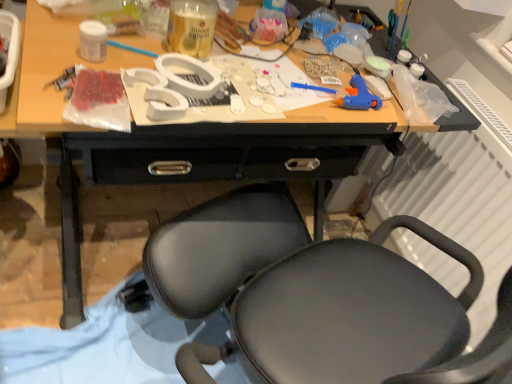
Question: Is white matte jar at upper left, acting as the third bottle starting from the right, at the right side of white plastic radiator at right?

Choices:
 (A) yes
 (B) no

Answer: (B)

Question: Does white matte jar at upper left, the 1th bottle viewed from the left, have a smaller size compared to white plastic radiator at right?

Choices:
 (A) yes
 (B) no

Answer: (A)

Question: Is the surface of white matte jar at upper left, arranged as the 3th bottle when viewed from the back, in direct contact with white plastic radiator at right?

Choices:
 (A) no
 (B) yes

Answer: (A)

Question: Can you confirm if white matte jar at upper left, acting as the third bottle starting from the right, is shorter than white plastic radiator at right?

Choices:
 (A) yes
 (B) no

Answer: (A)

Question: Is white matte jar at upper left, placed as the first bottle when sorted from front to back, to the left of white plastic radiator at right from the viewer's perspective?

Choices:
 (A) yes
 (B) no

Answer: (A)

Question: Relative to white plastic radiator at right, is translucent glass bottle at center, the second bottle from the back, in front or behind?

Choices:
 (A) behind
 (B) front

Answer: (A)

Question: Considering the positions of translucent glass bottle at center, the second bottle viewed from the right, and white plastic radiator at right in the image, is translucent glass bottle at center, the second bottle viewed from the right, wider or thinner than white plastic radiator at right?

Choices:
 (A) wide
 (B) thin

Answer: (A)

Question: Considering the positions of translucent glass bottle at center, which appears as the 2th bottle when viewed from the front, and white plastic radiator at right in the image, is translucent glass bottle at center, which appears as the 2th bottle when viewed from the front, taller or shorter than white plastic radiator at right?

Choices:
 (A) tall
 (B) short

Answer: (B)

Question: From a real-world perspective, is translucent glass bottle at center, placed as the second bottle when sorted from left to right, positioned above or below white plastic radiator at right?

Choices:
 (A) below
 (B) above

Answer: (B)

Question: Considering their positions, is white plastic radiator at right located in front of or behind white matte jar at upper left, the 1th bottle viewed from the left?

Choices:
 (A) front
 (B) behind

Answer: (A)

Question: Is white plastic radiator at right taller or shorter than white matte jar at upper left, placed as the first bottle when sorted from front to back?

Choices:
 (A) short
 (B) tall

Answer: (B)

Question: Considering the relative positions of white plastic radiator at right and white matte jar at upper left, the 1th bottle viewed from the left, in the image provided, is white plastic radiator at right to the left or to the right of white matte jar at upper left, the 1th bottle viewed from the left,?

Choices:
 (A) left
 (B) right

Answer: (B)

Question: From a real-world perspective, is white plastic radiator at right physically located above or below white matte jar at upper left, arranged as the 3th bottle when viewed from the back?

Choices:
 (A) above
 (B) below

Answer: (B)

Question: Considering the positions of translucent plastic bottle at upper center, positioned as the first bottle in back-to-front order, and black matte chair at center in the image, is translucent plastic bottle at upper center, positioned as the first bottle in back-to-front order, wider or thinner than black matte chair at center?

Choices:
 (A) wide
 (B) thin

Answer: (B)

Question: Visually, is translucent plastic bottle at upper center, positioned as the first bottle in back-to-front order, positioned to the left or to the right of black matte chair at center?

Choices:
 (A) left
 (B) right

Answer: (B)